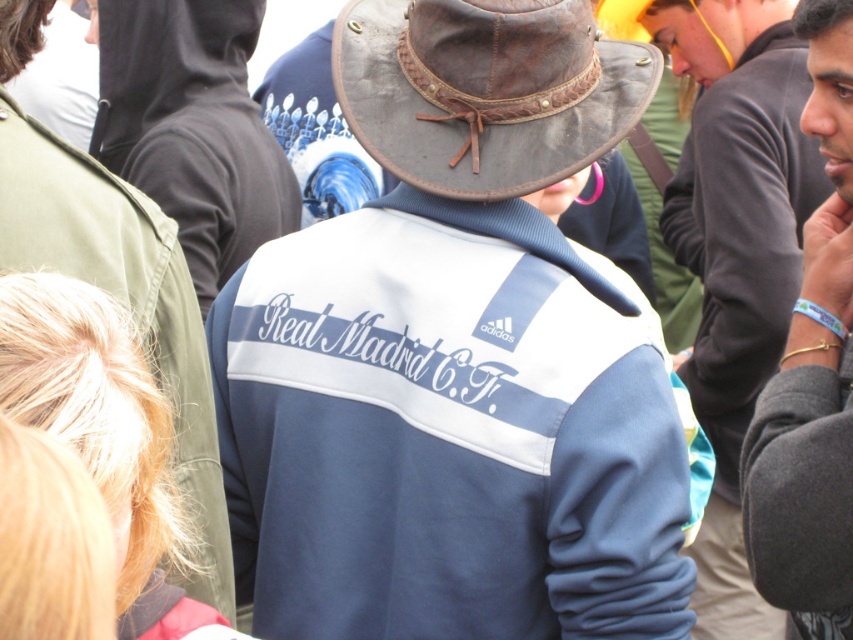
You are standing in the crowd and want to locate the dark gray sweatshirt at right. Where should you look?

You should look at point (743, 230) to locate the dark gray sweatshirt at right.

Consider the image. You are a photographer holding a camera and standing near the gray fleece jacket at center. You want to take a photo of the group without moving the camera. Can you capture the entire group in the frame?

The gray fleece jacket at center and camera are 3.20 meters apart. Since the camera is positioned 3.20 meters away from the jacket, which is part of the group, it is possible to capture the entire group in the frame if the camera has a wide enough lens to encompass all members at that distance.

You are a photographer trying to capture a group photo of the crowd. You notice the dark gray sweatshirt at right and the blue fleece jacket at center. Which clothing item should you focus on to ensure it appears larger in the photo?

The dark gray sweatshirt at right is much taller than the blue fleece jacket at center, so focusing on it would make it appear larger in the photo.